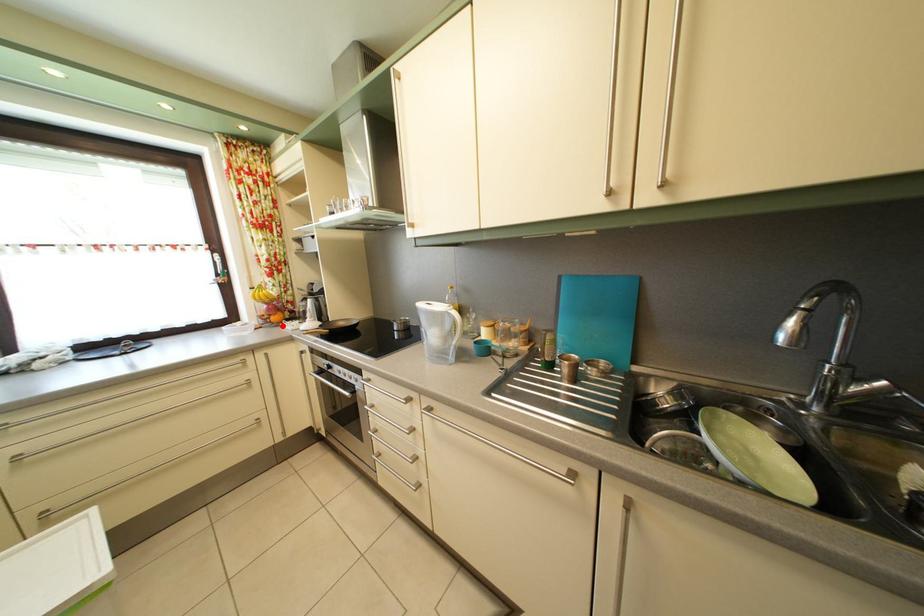
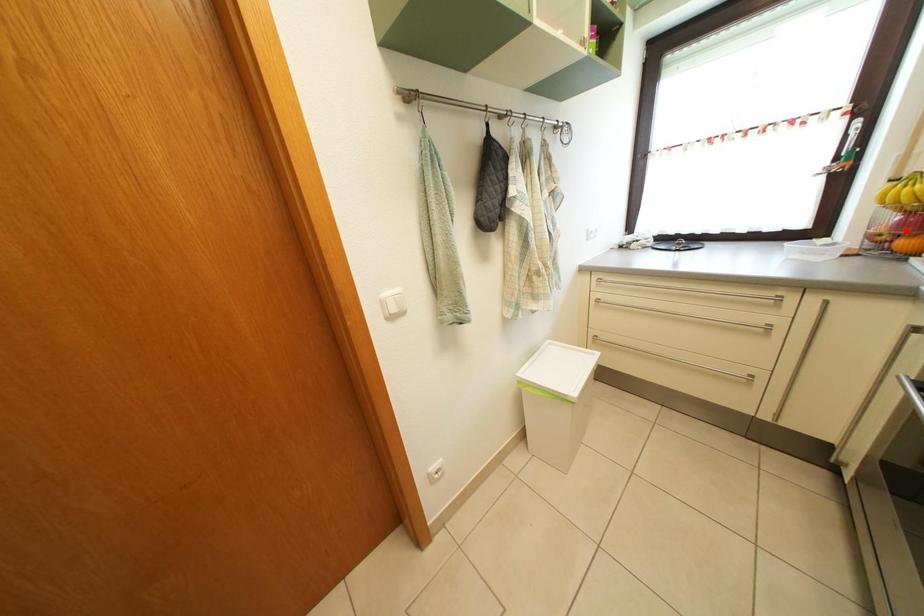
I am providing you with two images of the same scene from different viewpoints. A red point is marked on the first image and another point is marked on the second image. Do the highlighted points in image1 and image2 indicate the same real-world spot?

No